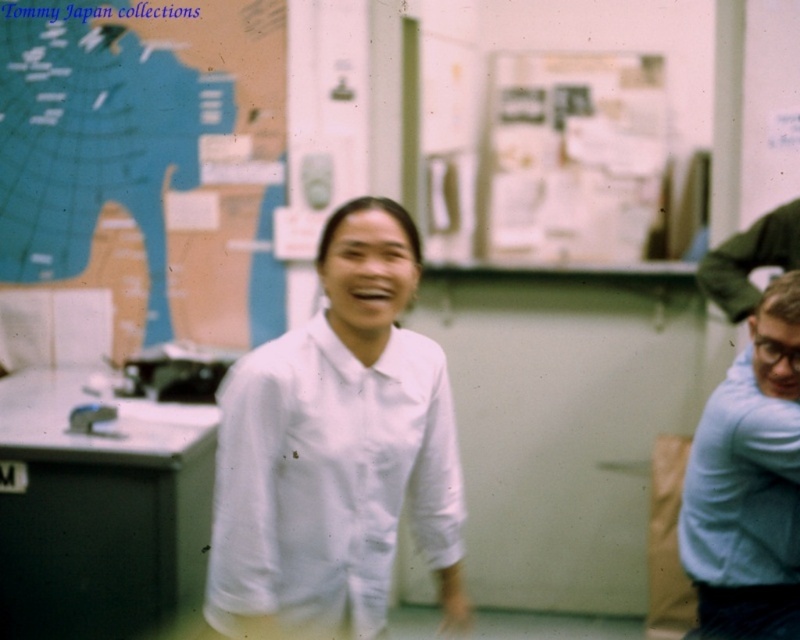
Question: Estimate the real-world distances between objects in this image. Which object is closer to the light blue sweater at right?

Choices:
 (A) white paperboard at upper center
 (B) white smooth shirt at center

Answer: (B)

Question: Does white smooth shirt at center come in front of light blue sweater at right?

Choices:
 (A) no
 (B) yes

Answer: (B)

Question: Does white smooth shirt at center come in front of white paperboard at upper center?

Choices:
 (A) yes
 (B) no

Answer: (A)

Question: Can you confirm if white paperboard at upper center is positioned to the left of light blue sweater at right?

Choices:
 (A) yes
 (B) no

Answer: (A)

Question: Which is nearer to the white smooth shirt at center?

Choices:
 (A) white paperboard at upper center
 (B) light blue sweater at right

Answer: (B)

Question: Which object appears farthest from the camera in this image?

Choices:
 (A) white smooth shirt at center
 (B) white paperboard at upper center

Answer: (B)